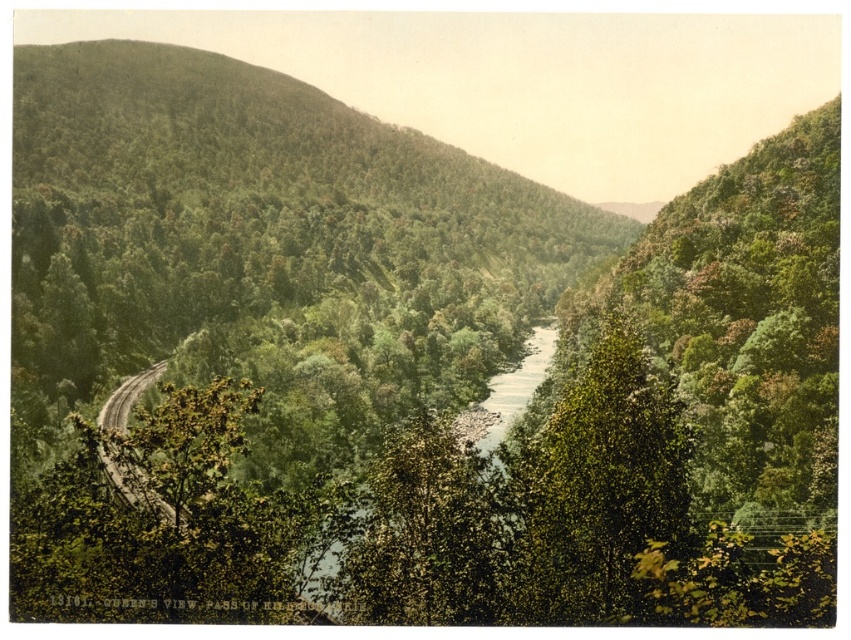
Can you confirm if green leafy tree at center is positioned to the left of green leafy river at center?

Yes, green leafy tree at center is to the left of green leafy river at center.

Can you confirm if green leafy tree at center is smaller than green leafy river at center?

Indeed, green leafy tree at center has a smaller size compared to green leafy river at center.

Describe the element at coordinates (598, 490) in the screenshot. This screenshot has width=851, height=640. I see `green leafy tree at center` at that location.

Find the location of a particular element. The height and width of the screenshot is (640, 851). green leafy tree at center is located at coordinates (598, 490).

Does green leafy river at center have a greater height compared to brown gravel road at lower left?

Yes, green leafy river at center is taller than brown gravel road at lower left.

Is point (475, 436) more distant than point (129, 403)?

Yes, point (475, 436) is farther from viewer.

Identify the location of green leafy river at center. (512, 390).

Does green leafy tree at center appear on the right side of brown gravel road at lower left?

Correct, you'll find green leafy tree at center to the right of brown gravel road at lower left.

Who is more distant from viewer, (580, 454) or (100, 456)?

Point (100, 456)

Image resolution: width=851 pixels, height=640 pixels. In order to click on green leafy tree at center in this screenshot , I will do `click(598, 490)`.